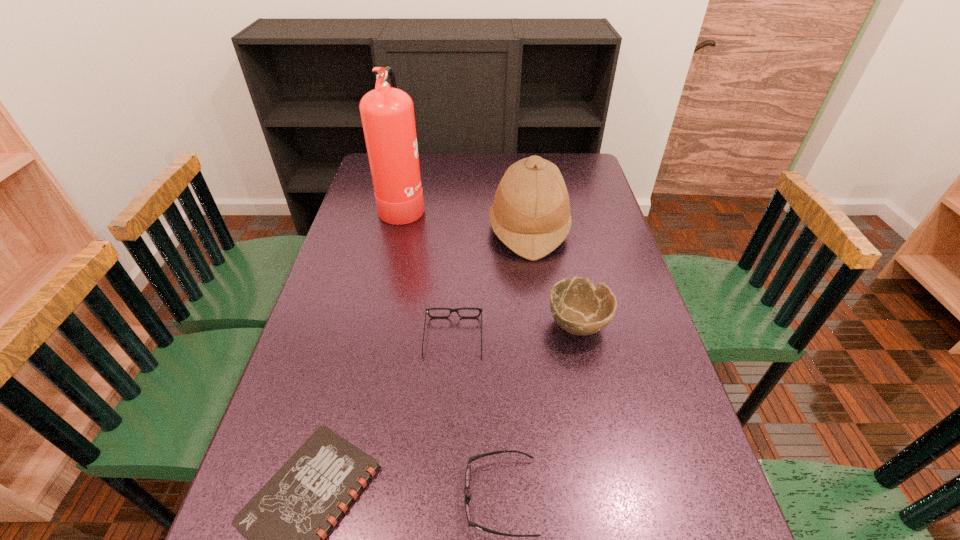
You are a GUI agent. You are given a task and a screenshot of the screen. Output one action in this format:
    pyautogui.click(x=<x>, y=<y>)
    Task: Click on the free area in between the spectacles and the bowl
    The height and width of the screenshot is (540, 960).
    Given the screenshot: What is the action you would take?
    pyautogui.click(x=516, y=330)

Find the location of `empty location between the spectacles and the fifth shortest object`. empty location between the spectacles and the fifth shortest object is located at coordinates (491, 283).

Image resolution: width=960 pixels, height=540 pixels. What are the coordinates of `free space between the second tallest object and the spectacles` in the screenshot? It's located at (491, 283).

This screenshot has height=540, width=960. I want to click on free space between the bowl and the hat, so click(x=554, y=276).

The width and height of the screenshot is (960, 540). Find the location of `object that stands as the fourth closest to the fire extinguisher`. object that stands as the fourth closest to the fire extinguisher is located at coordinates (286, 522).

Find the location of a particular element. Image resolution: width=960 pixels, height=540 pixels. the closest object relative to the spectacles is located at coordinates (578, 307).

Locate an element on the screen. vacant position in the image that satisfies the following two spatial constraints: 1. on the back side of the third tallest object; 2. on the front-facing side of the hat is located at coordinates (558, 228).

This screenshot has width=960, height=540. I want to click on vacant space that satisfies the following two spatial constraints: 1. on the front-facing side of the spectacles; 2. on the left side of the fourth shortest object, so click(454, 323).

At what (x,y) coordinates should I click in order to perform the action: click on vacant space that satisfies the following two spatial constraints: 1. towards the nozzle of the fire extinguisher; 2. on the left side of the fourth shortest object. Please return your answer as a coordinate pair (x, y). This screenshot has height=540, width=960. Looking at the image, I should click on (376, 323).

At what (x,y) coordinates should I click in order to perform the action: click on free point that satisfies the following two spatial constraints: 1. on the front-facing side of the hat; 2. on the back side of the fourth shortest object. Please return your answer as a coordinate pair (x, y). This screenshot has height=540, width=960. Looking at the image, I should click on point(541,323).